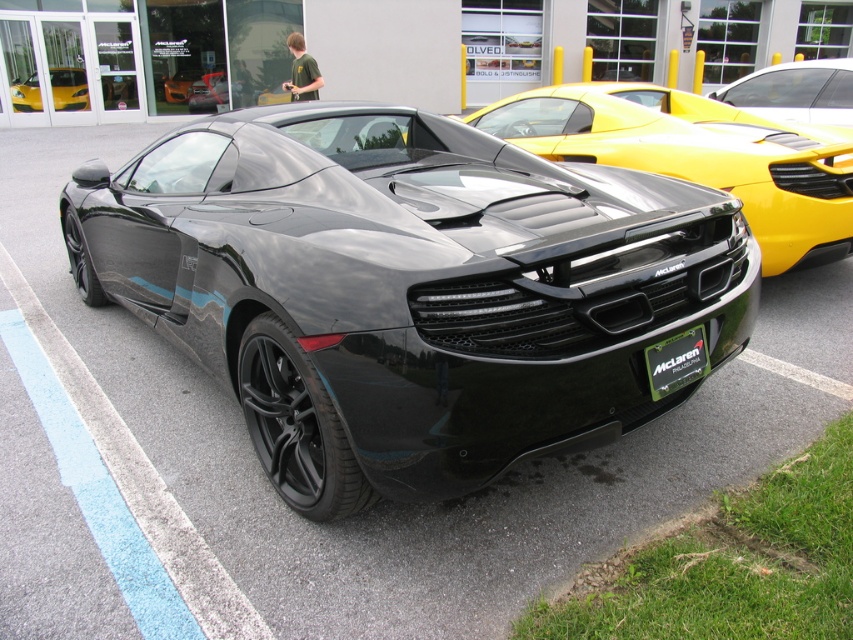
Question: Estimate the real-world distances between objects in this image. Which object is closer to the glossy black car at center?

Choices:
 (A) metallic orange sedan at center
 (B) yellow matte sports car at upper right

Answer: (A)

Question: Which of the following is the farthest from the observer?

Choices:
 (A) (283, 88)
 (B) (827, 140)

Answer: (A)

Question: Which object is farther from the camera taking this photo?

Choices:
 (A) yellow matte sports car at upper right
 (B) glossy black car at center
 (C) green matte license plate at rear
 (D) metallic orange sedan at center

Answer: (B)

Question: Does metallic orange sedan at center have a larger size compared to glossy black car at center?

Choices:
 (A) yes
 (B) no

Answer: (A)

Question: Can you confirm if yellow matte sports car at upper right is positioned to the right of metallic orange sedan at center?

Choices:
 (A) no
 (B) yes

Answer: (B)

Question: From the image, what is the correct spatial relationship of yellow matte sports car at upper right in relation to glossy black car at center?

Choices:
 (A) below
 (B) above

Answer: (A)